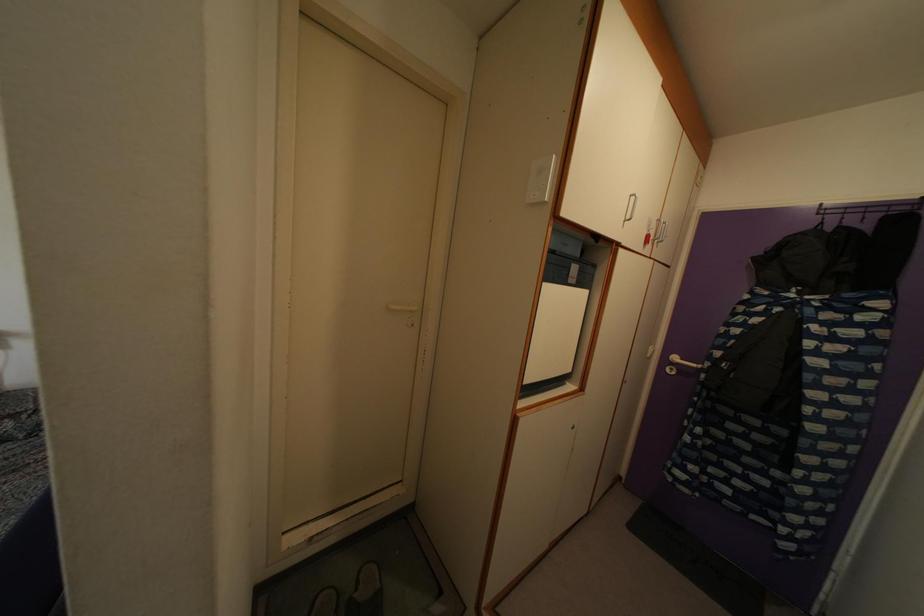
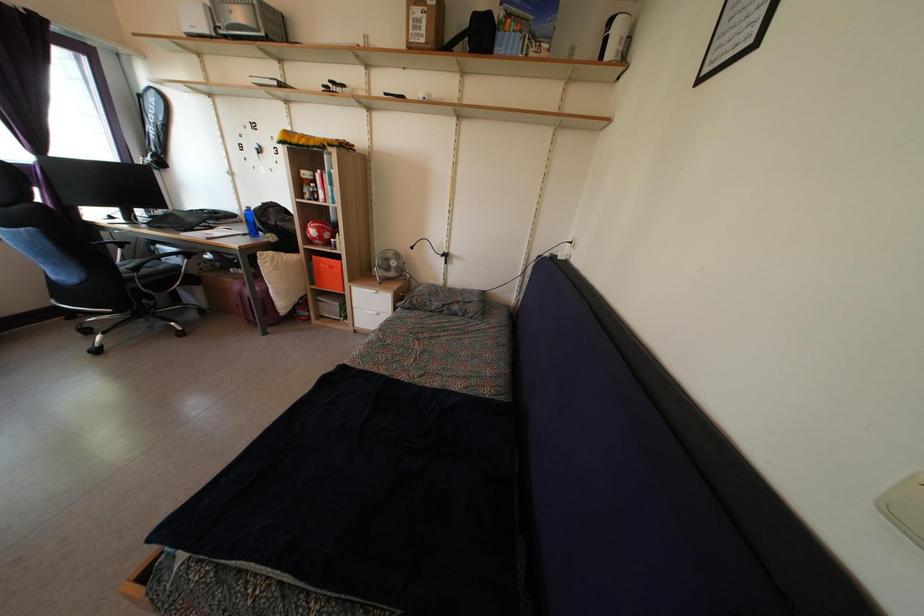
Question: The camera is either moving clockwise (left) or counter-clockwise (right) around the object. The first image is from the beginning of the video and the second image is from the end. Is the camera moving left or right when shooting the video?

Choices:
 (A) Left
 (B) Right

Answer: (B)